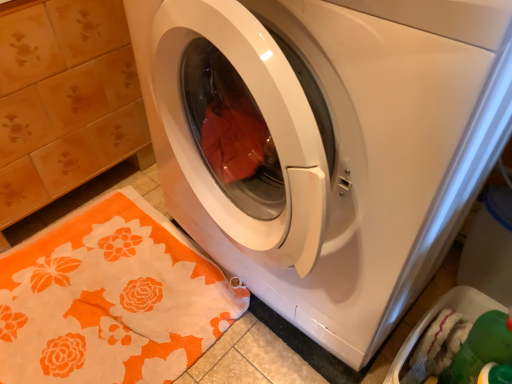
Question: Do you think green plastic dish washer at lower right is within orange floral rug at lower left, or outside of it?

Choices:
 (A) inside
 (B) outside

Answer: (B)

Question: From their relative heights in the image, would you say green plastic dish washer at lower right is taller or shorter than orange floral rug at lower left?

Choices:
 (A) short
 (B) tall

Answer: (B)

Question: Considering the real-world distances, which object is closest to the orange floral rug at lower left?

Choices:
 (A) green plastic dish washer at lower right
 (B) white glossy washing machine at center

Answer: (B)

Question: Which is nearer to the orange floral rug at lower left?

Choices:
 (A) green plastic dish washer at lower right
 (B) white glossy washing machine at center

Answer: (B)